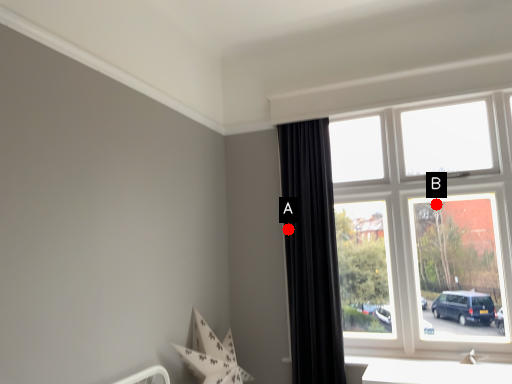
Question: Two points are circled on the image, labeled by A and B beside each circle. Which point is closer to the camera?

Choices:
 (A) A is closer
 (B) B is closer

Answer: (B)